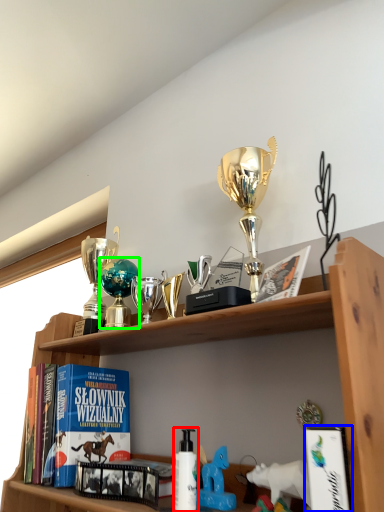
Question: Which is farther away from bottle (highlighted by a red box)? book (highlighted by a blue box) or toy (highlighted by a green box)?

Choices:
 (A) book
 (B) toy

Answer: (B)